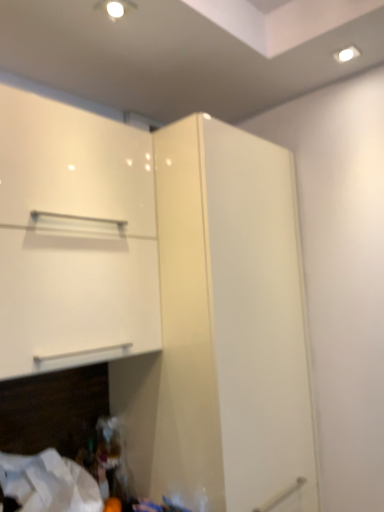
Describe the element at coordinates (74, 237) in the screenshot. The height and width of the screenshot is (512, 384). I see `white glossy cabinet at upper left` at that location.

Describe the element at coordinates (49, 483) in the screenshot. The width and height of the screenshot is (384, 512). I see `white fabric at lower left` at that location.

This screenshot has width=384, height=512. In order to click on white glossy cabinet at upper left in this screenshot , I will do `click(74, 237)`.

Is white glossy cabinet at upper left smaller than glossy white cupboard at upper center?

No.

Would you consider white glossy cabinet at upper left to be distant from glossy white cupboard at upper center?

white glossy cabinet at upper left is near glossy white cupboard at upper center, not far away.

Which object is closer to the camera taking this photo, white glossy cabinet at upper left or glossy white cupboard at upper center?

glossy white cupboard at upper center.

Is white glossy cabinet at upper left spatially inside glossy white cupboard at upper center, or outside of it?

white glossy cabinet at upper left lies outside glossy white cupboard at upper center.

Where is `cabinetry on the right of white fabric at lower left`? The height and width of the screenshot is (512, 384). cabinetry on the right of white fabric at lower left is located at coordinates (74, 237).

Is white glossy cabinet at upper left touching white fabric at lower left?

white glossy cabinet at upper left is not next to white fabric at lower left, and they're not touching.

Between white glossy cabinet at upper left and white fabric at lower left, which one is positioned in front?

white glossy cabinet at upper left is more forward.

Considering the positions of objects white fabric at lower left and white glossy cabinet at upper left in the image provided, who is more to the left, white fabric at lower left or white glossy cabinet at upper left?

From the viewer's perspective, white fabric at lower left appears more on the left side.

Would you say white fabric at lower left is a long distance from white glossy cabinet at upper left?

They are positioned close to each other.

From a real-world perspective, is white fabric at lower left beneath white glossy cabinet at upper left?

Yes, from a real-world perspective, white fabric at lower left is below white glossy cabinet at upper left.

Choose the correct answer: Is white fabric at lower left inside white glossy cabinet at upper left or outside it?

white fabric at lower left is spatially situated outside white glossy cabinet at upper left.

Image resolution: width=384 pixels, height=512 pixels. I want to click on cabinetry lying on the left of glossy white cupboard at upper center, so click(74, 237).

Are glossy white cupboard at upper center and white glossy cabinet at upper left located far from each other?

No, glossy white cupboard at upper center is not far from white glossy cabinet at upper left.

Looking at this image, from the image's perspective, which is below, glossy white cupboard at upper center or white glossy cabinet at upper left?

glossy white cupboard at upper center appears lower in the image.

Considering the positions of points (142, 490) and (73, 294), is point (142, 490) farther from camera compared to point (73, 294)?

That is True.

Who is bigger, glossy white cupboard at upper center or white fabric at lower left?

glossy white cupboard at upper center.

Is glossy white cupboard at upper center aimed at white fabric at lower left?

No, glossy white cupboard at upper center is not oriented towards white fabric at lower left.

From the image's perspective, is glossy white cupboard at upper center positioned above or below white fabric at lower left?

glossy white cupboard at upper center is above white fabric at lower left.

Who is taller, glossy white cupboard at upper center or white fabric at lower left?

With more height is glossy white cupboard at upper center.

Between white fabric at lower left and glossy white cupboard at upper center, which one is positioned behind?

white fabric at lower left is further from the camera.

Is white fabric at lower left at the left side of glossy white cupboard at upper center?

Correct, you'll find white fabric at lower left to the left of glossy white cupboard at upper center.

How many degrees apart are the facing directions of white fabric at lower left and glossy white cupboard at upper center?

white fabric at lower left and glossy white cupboard at upper center are facing 0.387 degrees away from each other.

In order to click on cabinetry on the left of glossy white cupboard at upper center in this screenshot , I will do `click(74, 237)`.

Where is `sheet behind the white glossy cabinet at upper left`? sheet behind the white glossy cabinet at upper left is located at coordinates (49, 483).

Looking at the image, which one is located further to white glossy cabinet at upper left, white fabric at lower left or glossy white cupboard at upper center?

white fabric at lower left is further to white glossy cabinet at upper left.

Looking at this image, when comparing their distances from white glossy cabinet at upper left, does glossy white cupboard at upper center or white fabric at lower left seem further?

The object further to white glossy cabinet at upper left is white fabric at lower left.

From the image, which object appears to be farther from glossy white cupboard at upper center, white glossy cabinet at upper left or white fabric at lower left?

Among the two, white fabric at lower left is located further to glossy white cupboard at upper center.

Consider the image. From the image, which object appears to be nearer to glossy white cupboard at upper center, white fabric at lower left or white glossy cabinet at upper left?

white glossy cabinet at upper left.

Looking at the image, which one is located closer to white fabric at lower left, white glossy cabinet at upper left or glossy white cupboard at upper center?

glossy white cupboard at upper center lies closer to white fabric at lower left than the other object.

Looking at the image, which one is located further to white fabric at lower left, glossy white cupboard at upper center or white glossy cabinet at upper left?

The object further to white fabric at lower left is white glossy cabinet at upper left.

At what (x,y) coordinates should I click in order to perform the action: click on cupboard between white glossy cabinet at upper left and white fabric at lower left from top to bottom. Please return your answer as a coordinate pair (x, y). Looking at the image, I should click on coord(164,293).